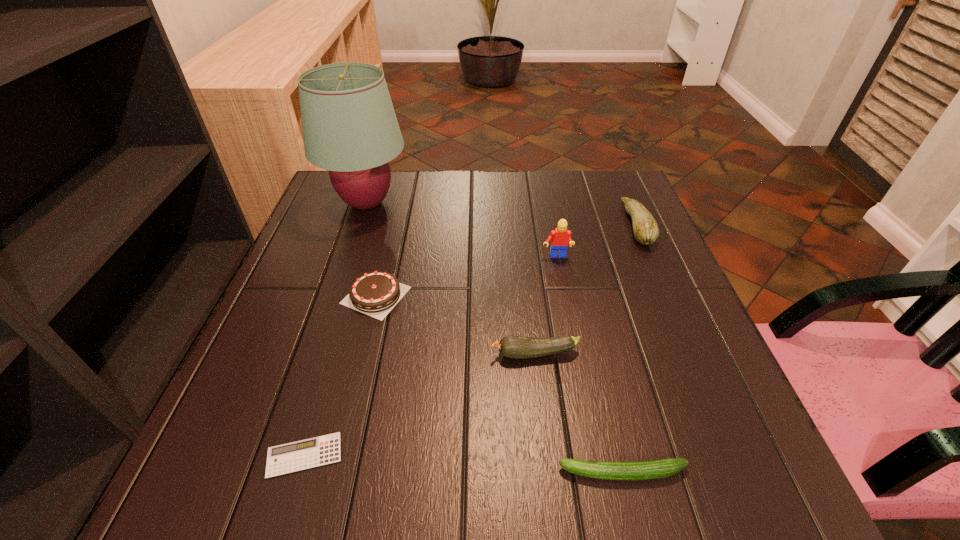
I want to click on the tallest object, so click(x=350, y=128).

Locate an element on the screen. The height and width of the screenshot is (540, 960). Lego is located at coordinates (560, 238).

Identify the location of the sixth shortest object. (560, 238).

Image resolution: width=960 pixels, height=540 pixels. I want to click on the fifth shortest object, so click(x=646, y=231).

Find the location of a particular element. the tallest zucchini is located at coordinates (646, 231).

Identify the location of the fifth farthest object. The height and width of the screenshot is (540, 960). (516, 347).

Locate an element on the screen. the fourth tallest object is located at coordinates (516, 347).

Locate an element on the screen. The height and width of the screenshot is (540, 960). the fourth nearest object is located at coordinates (375, 293).

The image size is (960, 540). Identify the location of the third shortest object. (375, 293).

Locate an element on the screen. The height and width of the screenshot is (540, 960). the nearest zucchini is located at coordinates (642, 470).